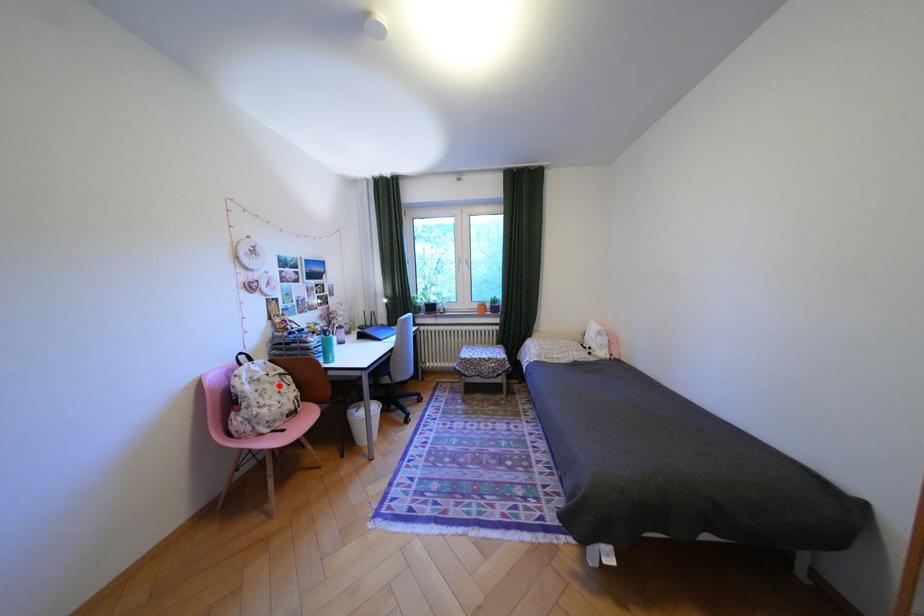
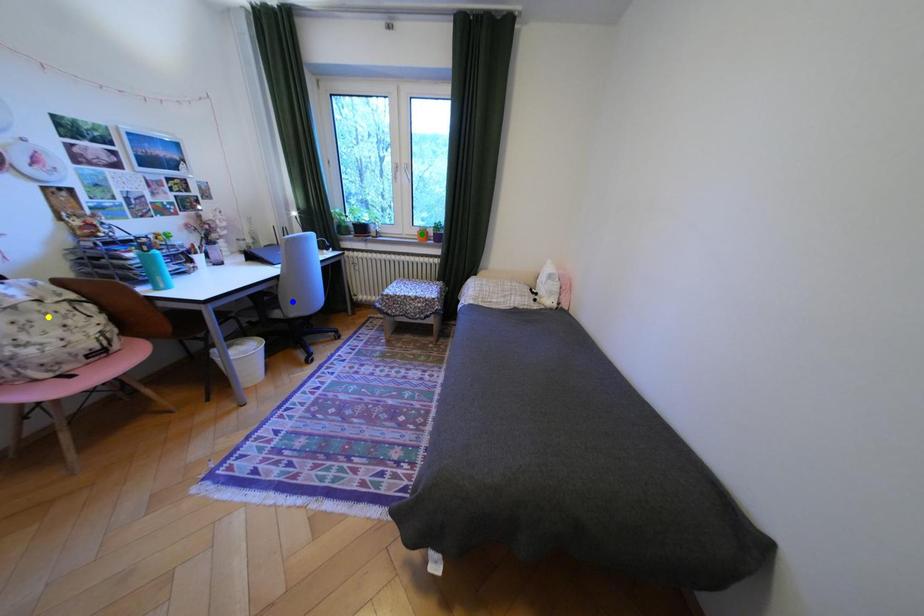
Question: I am providing you with two images of the same scene from different viewpoints. A red point is marked on the first image. You are given multiple points on the second image. Which point in image 2 is actually the same real-world point as the red point in image 1?

Choices:
 (A) yellow point
 (B) blue point
 (C) green point

Answer: (A)